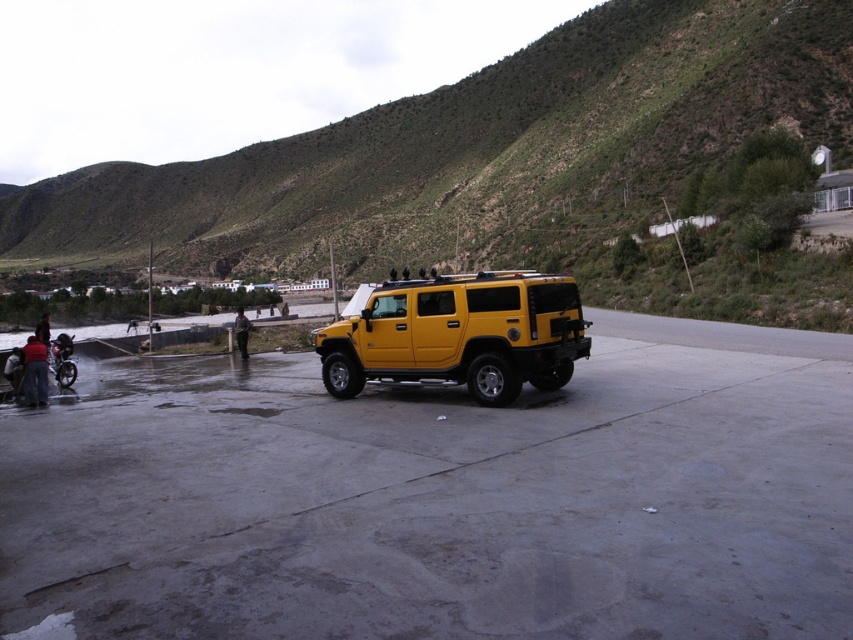
Question: Observing the image, what is the correct spatial positioning of green grassy hillside at upper center in reference to matte yellow suv at center?

Choices:
 (A) left
 (B) right

Answer: (A)

Question: Which of the following is the farthest from the observer?

Choices:
 (A) (341, 141)
 (B) (24, 384)

Answer: (A)

Question: Is green grassy hillside at upper center closer to the viewer compared to dark brown leather jacket at lower left?

Choices:
 (A) no
 (B) yes

Answer: (A)

Question: Which of the following is the farthest from the observer?

Choices:
 (A) (35, 328)
 (B) (45, 400)
 (C) (503, 388)
 (D) (26, 374)

Answer: (A)

Question: Does yellow matte suv at center have a larger size compared to red cotton shirt at lower left?

Choices:
 (A) yes
 (B) no

Answer: (A)

Question: Which is nearer to the matte yellow suv at center?

Choices:
 (A) yellow matte suv at center
 (B) metallic silver motorcycle at lower left

Answer: (B)